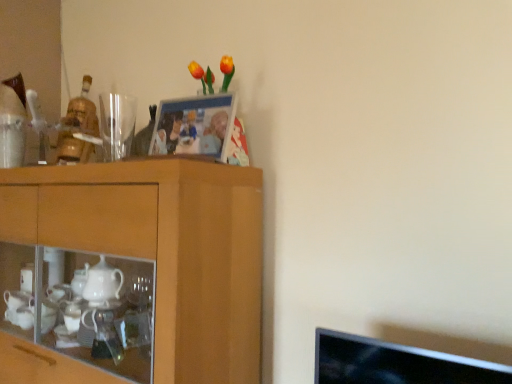
Question: Is transparent glass at upper left shorter than wooden cabinet at left?

Choices:
 (A) yes
 (B) no

Answer: (A)

Question: Does transparent glass at upper left turn towards wooden cabinet at left?

Choices:
 (A) yes
 (B) no

Answer: (B)

Question: Considering the relative sizes of transparent glass at upper left and wooden cabinet at left in the image provided, is transparent glass at upper left bigger than wooden cabinet at left?

Choices:
 (A) yes
 (B) no

Answer: (B)

Question: From the image's perspective, is transparent glass at upper left beneath wooden cabinet at left?

Choices:
 (A) yes
 (B) no

Answer: (B)

Question: Considering the relative sizes of transparent glass at upper left and wooden cabinet at left in the image provided, is transparent glass at upper left thinner than wooden cabinet at left?

Choices:
 (A) yes
 (B) no

Answer: (A)

Question: Considering their positions, is transparent glass at upper left located in front of or behind wooden cabinet at left?

Choices:
 (A) behind
 (B) front

Answer: (A)

Question: Considering the positions of point (135, 115) and point (49, 182), is point (135, 115) closer or farther from the camera than point (49, 182)?

Choices:
 (A) closer
 (B) farther

Answer: (B)

Question: In the image, is transparent glass at upper left on the left side or the right side of wooden cabinet at left?

Choices:
 (A) left
 (B) right

Answer: (A)

Question: From a real-world perspective, relative to wooden cabinet at left, is transparent glass at upper left vertically above or below?

Choices:
 (A) above
 (B) below

Answer: (A)

Question: Considering the positions of wooden photo frame at upper center and transparent glass at upper left in the image, is wooden photo frame at upper center taller or shorter than transparent glass at upper left?

Choices:
 (A) tall
 (B) short

Answer: (A)

Question: Relative to transparent glass at upper left, is wooden photo frame at upper center in front or behind?

Choices:
 (A) front
 (B) behind

Answer: (A)

Question: In terms of width, does wooden photo frame at upper center look wider or thinner when compared to transparent glass at upper left?

Choices:
 (A) wide
 (B) thin

Answer: (B)

Question: From a real-world perspective, is wooden photo frame at upper center positioned above or below transparent glass at upper left?

Choices:
 (A) above
 (B) below

Answer: (B)

Question: From the image's perspective, is wooden photo frame at upper center located above or below wooden cabinet at left?

Choices:
 (A) above
 (B) below

Answer: (A)

Question: From a real-world perspective, is wooden photo frame at upper center above or below wooden cabinet at left?

Choices:
 (A) above
 (B) below

Answer: (A)